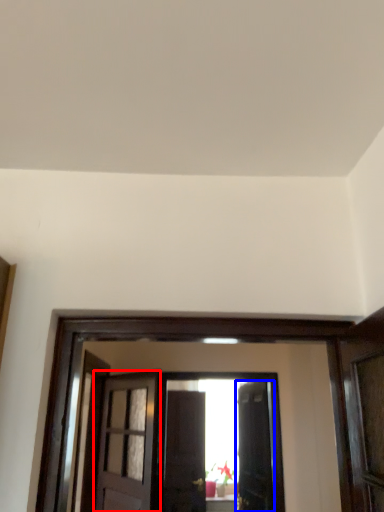
Question: Among these objects, which one is farthest to the camera, door (highlighted by a red box) or door (highlighted by a blue box)?

Choices:
 (A) door
 (B) door

Answer: (B)